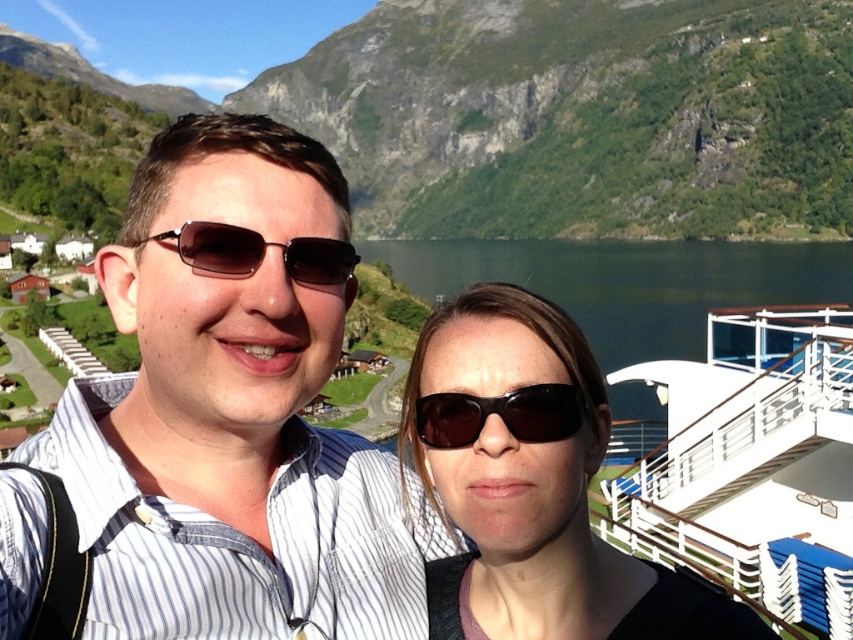
Is matte brown sunglasses at center positioned in front of dark blue water at center?

Yes.

Is matte brown sunglasses at center positioned at the back of dark blue water at center?

No, it is not.

Does point (283, 262) come in front of point (625, 358)?

Yes, point (283, 262) is closer to viewer.

Where is `matte brown sunglasses at center`? This screenshot has height=640, width=853. matte brown sunglasses at center is located at coordinates (234, 412).

Between green textured mountain at upper center and dark blue water at center, which one has more height?

green textured mountain at upper center is taller.

Is green textured mountain at upper center behind dark blue water at center?

Yes, it is behind dark blue water at center.

Does point (293, 68) lie in front of point (519, 244)?

No.

At what (x,y) coordinates should I click in order to perform the action: click on green textured mountain at upper center. Please return your answer as a coordinate pair (x, y). The width and height of the screenshot is (853, 640). Looking at the image, I should click on (582, 116).

Is point (654, 141) behind point (538, 385)?

Yes, point (654, 141) is farther from viewer.

Does green textured mountain at upper center have a larger size compared to black matte sunglasses at center?

Yes, green textured mountain at upper center is bigger than black matte sunglasses at center.

Is point (730, 141) farther from viewer compared to point (561, 413)?

Yes, point (730, 141) is farther from viewer.

Identify the location of green textured mountain at upper center. The height and width of the screenshot is (640, 853). (582, 116).